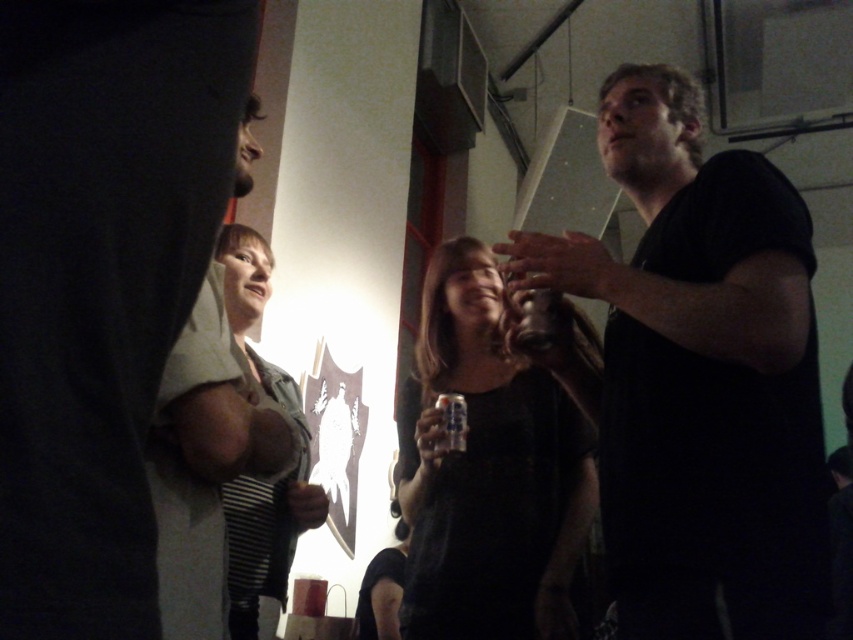
You are a photographer adjusting your camera settings in a dimly lit room. You notice the matte gray hoodie at left and the clear plastic bottle at center. Which object should you focus on first if you want to capture both in sharp detail?

The matte gray hoodie at left is above the clear plastic bottle at center, so focusing on the matte gray hoodie at left first would ensure it is in focus before adjusting for the closer clear plastic bottle at center.

You are standing in the room and want to move towards the matte gray hoodie at left. Based on its coordinates, which direction should you move relative to your current position?

The matte gray hoodie at left is located at coordinates point (204, 461), so you should move towards the left side of the frame to reach it.